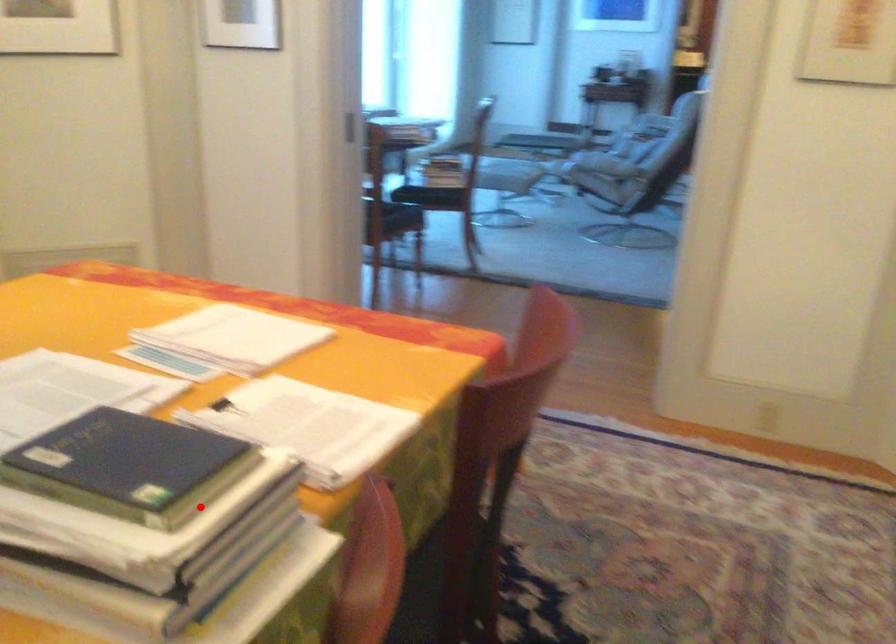
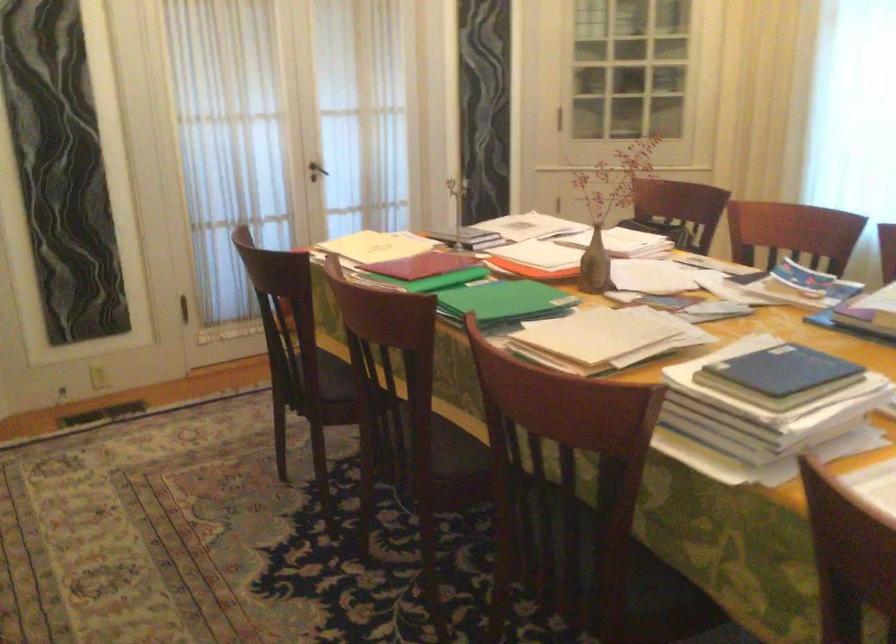
In the second image, find the point that corresponds to the highlighted location in the first image.

(782, 370)